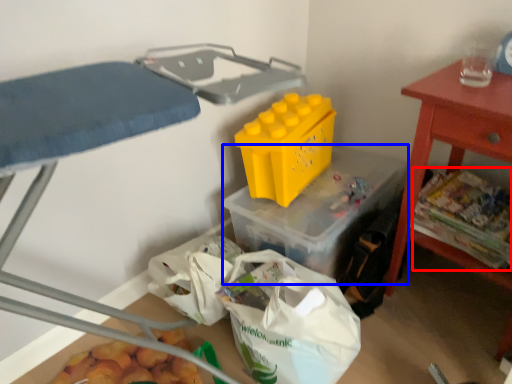
Question: Which of the following is the farthest to the observer, food (highlighted by a red box) or storage box (highlighted by a blue box)?

Choices:
 (A) food
 (B) storage box

Answer: (B)